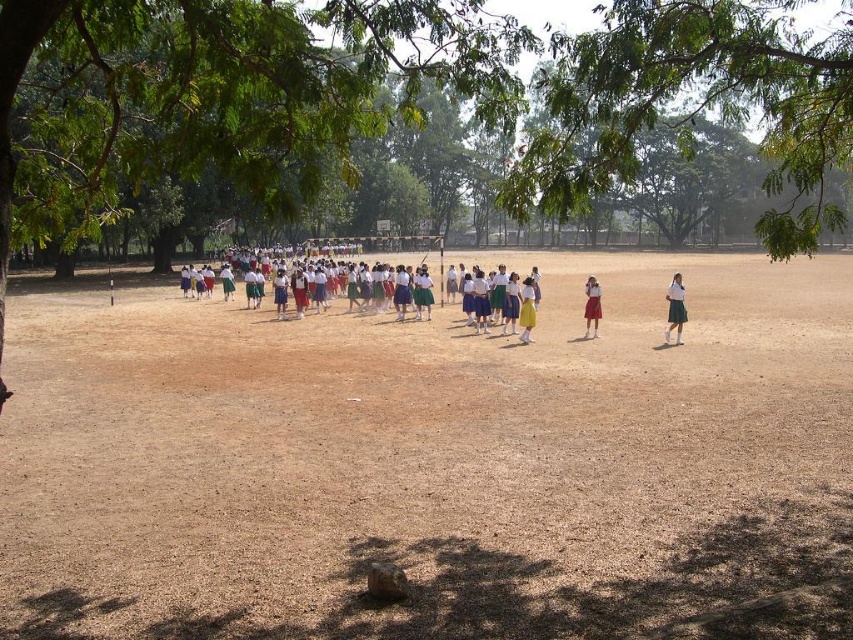
Question: Does brown sandy ground at center have a lesser width compared to matte red skirt at center?

Choices:
 (A) no
 (B) yes

Answer: (A)

Question: Among these points, which one is farthest from the camera?

Choices:
 (A) (566, 410)
 (B) (595, 282)

Answer: (B)

Question: Is green leafy tree at center closer to camera compared to matte red skirt at center?

Choices:
 (A) yes
 (B) no

Answer: (A)

Question: Which of these objects is positioned farthest from the green leafy tree at upper center?

Choices:
 (A) matte red skirt at center
 (B) matte white blouse at center
 (C) green leafy tree at center
 (D) brown sandy ground at center

Answer: (A)

Question: Which object appears closest to the camera in this image?

Choices:
 (A) green leafy tree at upper center
 (B) matte white blouse at center
 (C) matte red skirt at center

Answer: (A)

Question: Is green leafy tree at center smaller than matte white blouse at center?

Choices:
 (A) no
 (B) yes

Answer: (A)